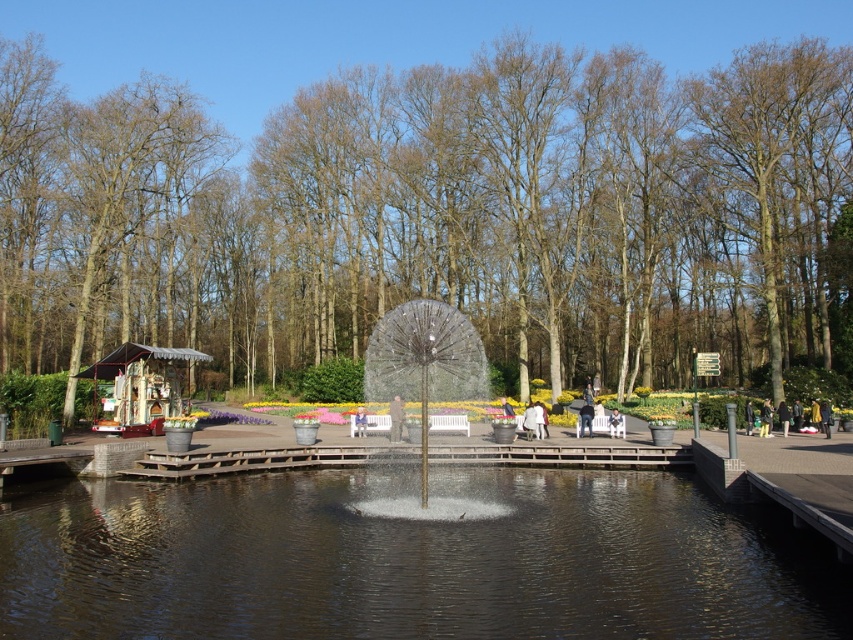
You are a visitor standing on the wooden platform around the fountain. You notice a clear glass sphere at center and a white fabric umbrella at center. Which object is positioned higher from the ground?

The clear glass sphere at center is above the white fabric umbrella at center, so the clear glass sphere at center is positioned higher from the ground.

You are standing at the center of the fountain and want to reach the point marked as point (767,426). Is this point closer to you than the point marked as point (358,406)?

Point (767,426) is in front of point (358,406), so yes, it is closer to your current position at the fountain center.

You are standing on the wooden platform around the fountain and notice both the clear glass sphere at center and the brown leather jacket at center. Which object is positioned more to the right side of the platform?

The clear glass sphere at center is positioned more to the right side of the platform compared to the brown leather jacket at center.